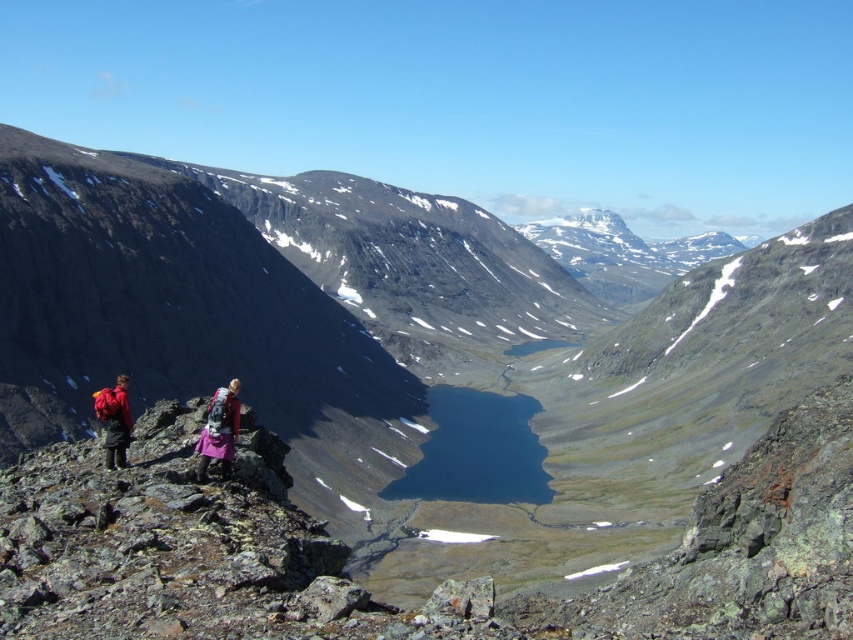
Who is higher up, purple fabric backpack at lower left or matte red backpack at left?

matte red backpack at left is higher up.

Is purple fabric backpack at lower left to the left of matte red backpack at left from the viewer's perspective?

In fact, purple fabric backpack at lower left is to the right of matte red backpack at left.

Where is `purple fabric backpack at lower left`? purple fabric backpack at lower left is located at coordinates (219, 429).

What are the coordinates of `purple fabric backpack at lower left` in the screenshot? It's located at (219, 429).